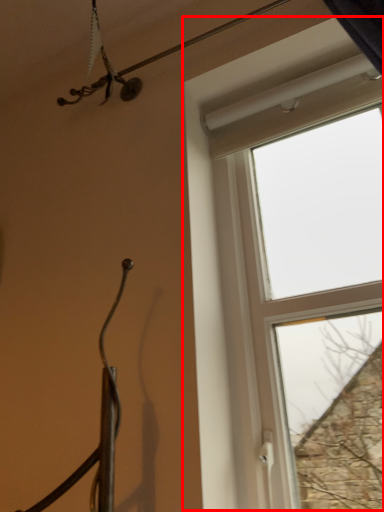
Question: Observing the image, what is the correct spatial positioning of window (annotated by the red box) in reference to wire?

Choices:
 (A) right
 (B) left

Answer: (A)